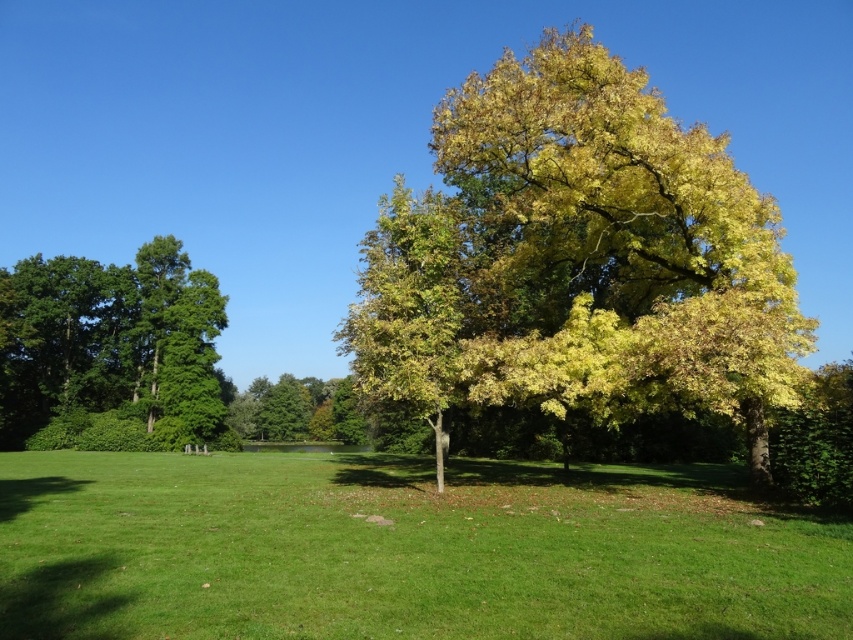
Is point (701, 369) closer to camera compared to point (315, 428)?

Yes, it is in front of point (315, 428).

Between point (438, 134) and point (297, 429), which one is positioned behind?

The point (297, 429) is more distant.

At what (x,y) coordinates should I click in order to perform the action: click on yellow-green foliage at center. Please return your answer as a coordinate pair (x, y). This screenshot has width=853, height=640. Looking at the image, I should click on (578, 259).

Based on the photo, is green grassy at center below yellow-green foliage at center?

Indeed, green grassy at center is positioned under yellow-green foliage at center.

What are the coordinates of `green grassy at center` in the screenshot? It's located at (404, 550).

Who is lower down, green grassy at center or green leafy tree at center?

green leafy tree at center is below.

Does point (755, 566) come farther from viewer compared to point (291, 419)?

No, (755, 566) is closer to viewer.

Image resolution: width=853 pixels, height=640 pixels. Describe the element at coordinates (404, 550) in the screenshot. I see `green grassy at center` at that location.

The image size is (853, 640). Find the location of `green grassy at center`. green grassy at center is located at coordinates (404, 550).